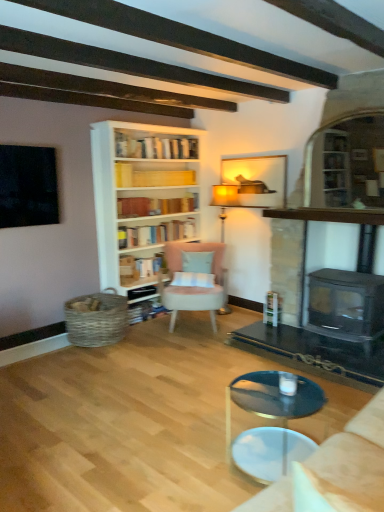
Question: From a real-world perspective, is clear glass coffee table at center located beneath hardcover books at center, which appears as the third book when ordered from the bottom?

Choices:
 (A) yes
 (B) no

Answer: (A)

Question: Does clear glass coffee table at center have a lesser height compared to hardcover books at center, arranged as the second book when viewed from the top?

Choices:
 (A) no
 (B) yes

Answer: (A)

Question: Can we say clear glass coffee table at center lies outside hardcover books at center, arranged as the second book when viewed from the top?

Choices:
 (A) yes
 (B) no

Answer: (A)

Question: Is clear glass coffee table at center surrounding hardcover books at center, which appears as the third book when ordered from the bottom?

Choices:
 (A) yes
 (B) no

Answer: (B)

Question: Is clear glass coffee table at center smaller than hardcover books at center, arranged as the second book when viewed from the top?

Choices:
 (A) yes
 (B) no

Answer: (B)

Question: Would you say clear glass coffee table at center is a long distance from hardcover books at center, which appears as the third book when ordered from the bottom?

Choices:
 (A) no
 (B) yes

Answer: (B)

Question: Does hardcover book at center, which is the first book in bottom-to-top order, have a lesser width compared to matte gold floor lamp at center?

Choices:
 (A) yes
 (B) no

Answer: (A)

Question: Can you confirm if hardcover book at center, which is the first book in bottom-to-top order, is taller than matte gold floor lamp at center?

Choices:
 (A) no
 (B) yes

Answer: (A)

Question: Is hardcover book at center, which is the fourth book from top to bottom, positioned far away from matte gold floor lamp at center?

Choices:
 (A) yes
 (B) no

Answer: (A)

Question: Can you confirm if hardcover book at center, which is the first book in bottom-to-top order, is bigger than matte gold floor lamp at center?

Choices:
 (A) yes
 (B) no

Answer: (B)

Question: Can you see hardcover book at center, which is the first book in bottom-to-top order, touching matte gold floor lamp at center?

Choices:
 (A) yes
 (B) no

Answer: (B)

Question: Is hardcover book at center, which is the first book in bottom-to-top order, at the left side of matte gold floor lamp at center?

Choices:
 (A) yes
 (B) no

Answer: (A)

Question: Is matte wooden picture frame at upper center further to camera compared to pink fabric chair at center?

Choices:
 (A) no
 (B) yes

Answer: (B)